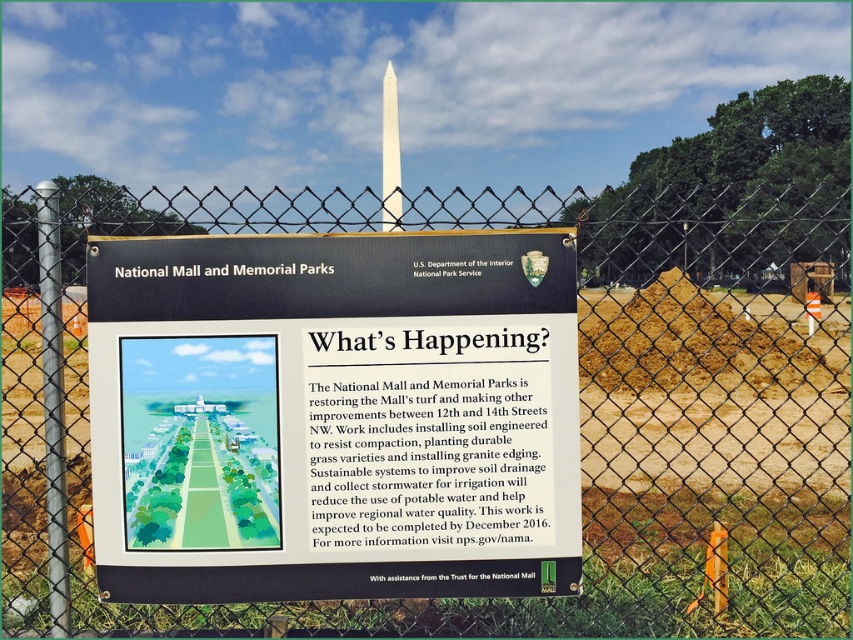
Question: Is metal chain-link fence at center bigger than white paper sign at center?

Choices:
 (A) no
 (B) yes

Answer: (B)

Question: Can you confirm if metal chain-link fence at center is positioned to the right of white paper sign at center?

Choices:
 (A) no
 (B) yes

Answer: (A)

Question: Which object appears farthest from the camera in this image?

Choices:
 (A) white paper sign at center
 (B) metal chain-link fence at center

Answer: (B)

Question: Is the position of metal chain-link fence at center less distant than that of white paper sign at center?

Choices:
 (A) yes
 (B) no

Answer: (B)

Question: Which point is farther from the camera taking this photo?

Choices:
 (A) (578, 429)
 (B) (830, 435)

Answer: (B)